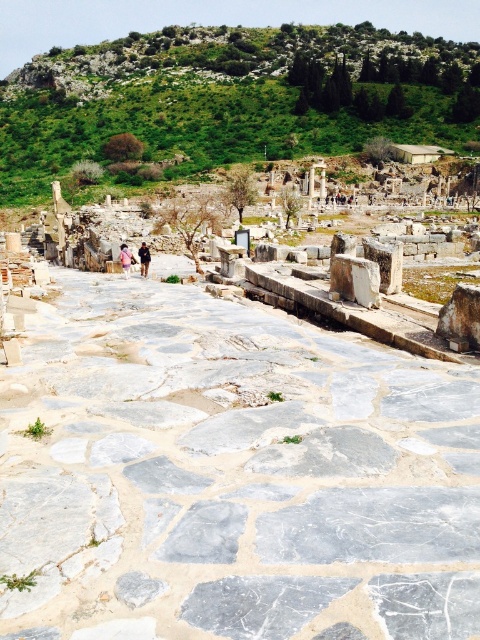
Looking at this image, is green grassy hillside at upper center closer to camera compared to pink fabric person at center?

No, green grassy hillside at upper center is behind pink fabric person at center.

Is green grassy hillside at upper center bigger than pink fabric person at center?

Yes, green grassy hillside at upper center is bigger than pink fabric person at center.

Does point (312, 60) lie in front of point (120, 257)?

No.

This screenshot has height=640, width=480. In order to click on green grassy hillside at upper center in this screenshot , I will do `click(231, 97)`.

Does gray marble stone at center have a lesser width compared to green grassy hillside at upper center?

Yes.

Who is more distant from viewer, [276,563] or [417,72]?

Point [417,72]

Does point (305, 548) come in front of point (118, 93)?

That is True.

Where is `gray marble stone at center`? This screenshot has width=480, height=640. gray marble stone at center is located at coordinates (231, 476).

How far apart are gray marble stone at center and pink fabric at center?

A distance of 40.43 meters exists between gray marble stone at center and pink fabric at center.

Can you confirm if gray marble stone at center is positioned to the left of pink fabric at center?

In fact, gray marble stone at center is to the right of pink fabric at center.

Between point (257, 609) and point (144, 244), which one is positioned in front?

Point (257, 609)

You are a GUI agent. You are given a task and a screenshot of the screen. Output one action in this format:
    pyautogui.click(x=<x>, y=<y>)
    Task: Click on the gray marble stone at center
    This screenshot has width=480, height=640.
    Given the screenshot: What is the action you would take?
    pyautogui.click(x=231, y=476)